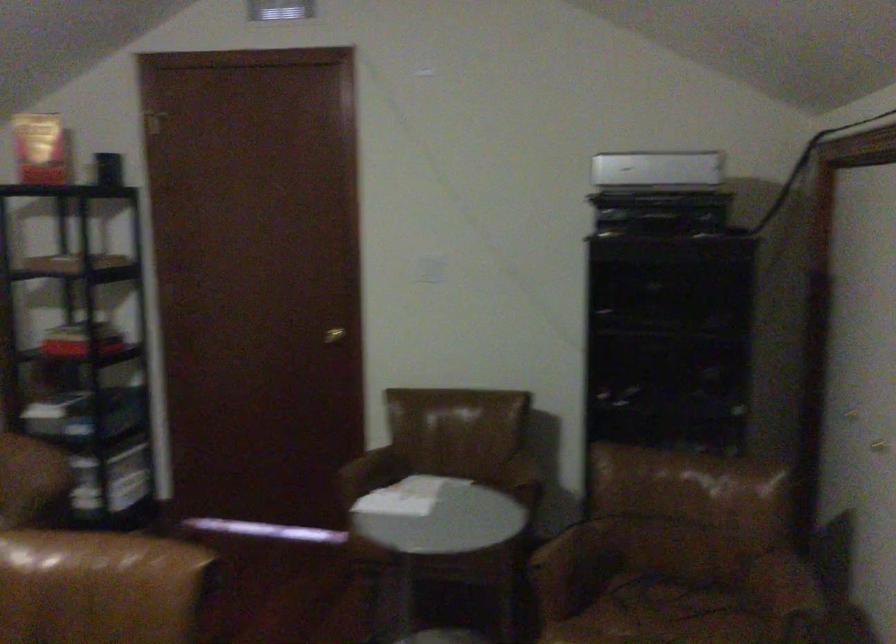
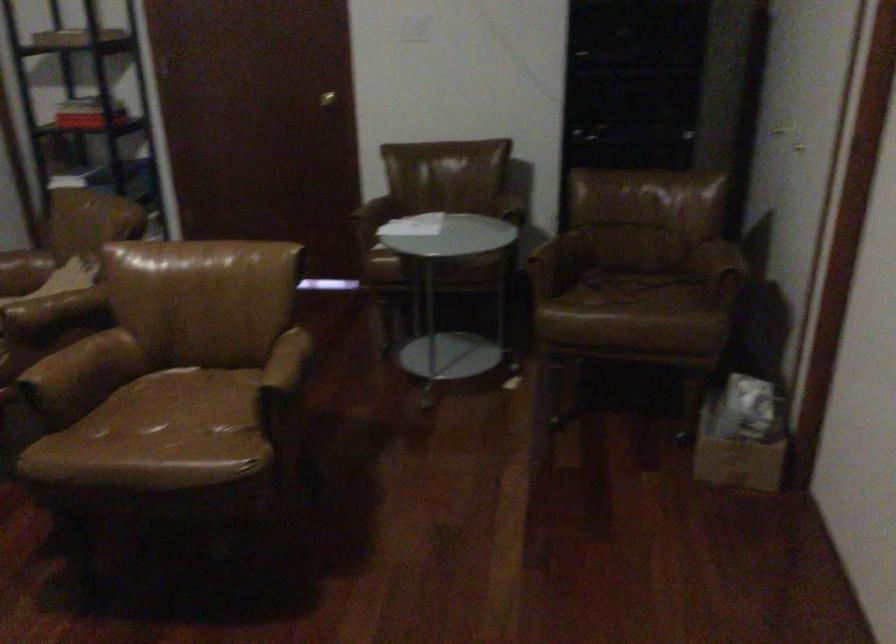
Question: The images are taken continuously from a first-person perspective. In which direction is your viewpoint rotating?

Choices:
 (A) Left
 (B) Right
 (C) Up
 (D) Down

Answer: (D)